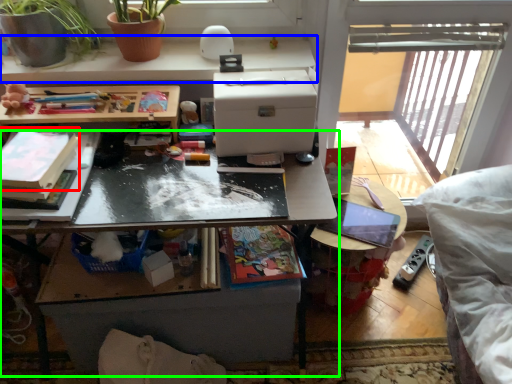
Question: Estimate the real-world distances between objects in this image. Which object is closer to book (highlighted by a red box), desk (highlighted by a blue box) or table (highlighted by a green box)?

Choices:
 (A) desk
 (B) table

Answer: (B)